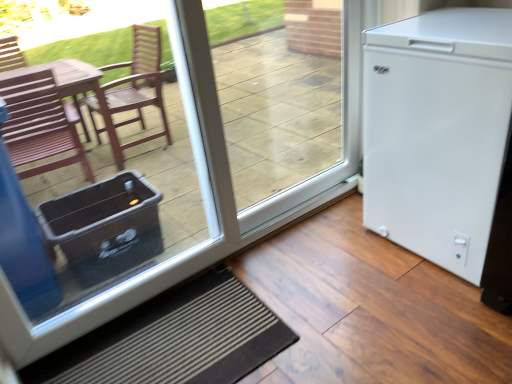
The image size is (512, 384). I want to click on blank space situated above black textured mat at lower center (from a real-world perspective), so click(161, 341).